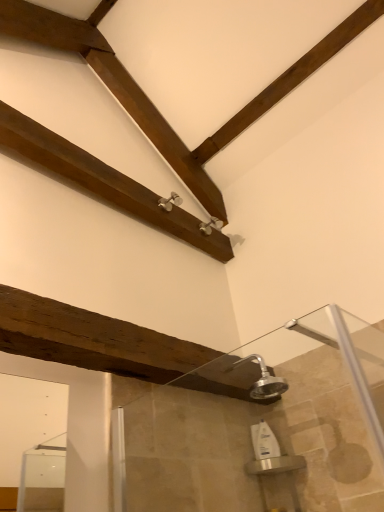
Describe the element at coordinates (262, 379) in the screenshot. I see `silver metallic shower head at center` at that location.

Locate an element on the screen. The image size is (384, 512). silver metallic shower head at center is located at coordinates (262, 379).

Identify the location of silver metallic shower head at center. (262, 379).